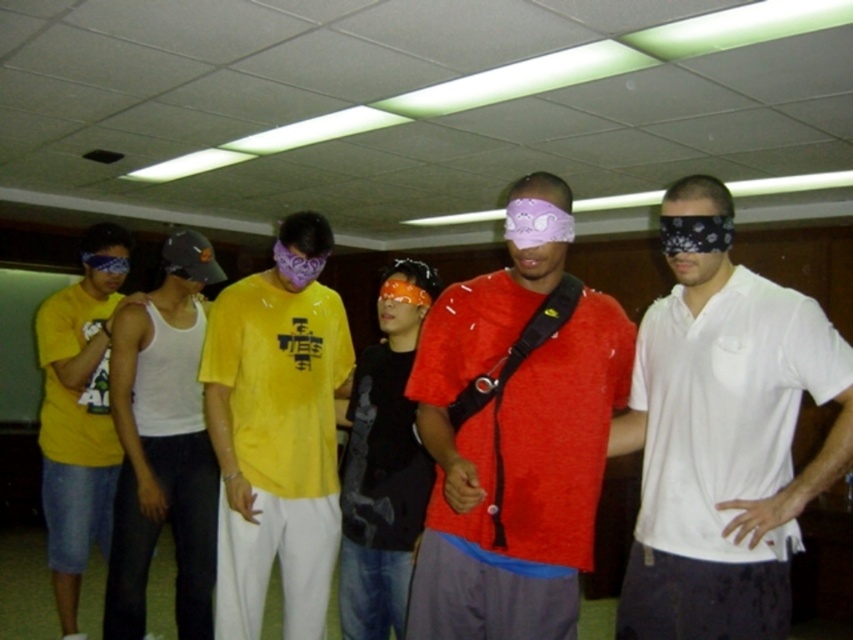
You are standing in the room and want to find the white cotton shirt at center. According to the coordinates provided, where should you look to locate it?

The white cotton shirt at center is located at point 0.689 along the horizontal axis and 0.849 along the vertical axis.